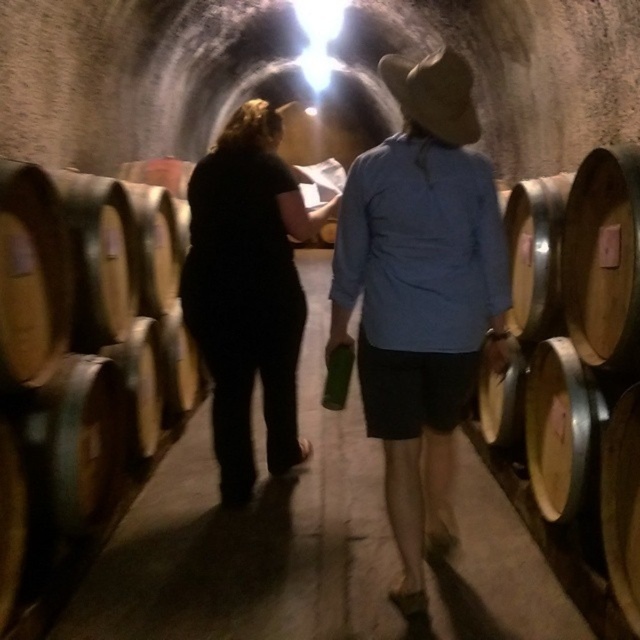
You are a delivery person carrying a box that is 1 meter wide. You need to pass through the tunnel in the wine cellar. Can you fit through the space between the wooden barrel at left and the matte black shirt at center?

The wooden barrel at left is narrower than the matte black shirt at center, so the space between them may vary depending on their positions. However, since the barrel is narrower, there might be enough space for the 1 meter wide box. But without knowing the exact distance between them, it is uncertain. However, the description only states the barrel is narrower, not the distance between them. Therefore, it is impossible to determine if the 1 meter wide box can fit through the space between them based on the

You are a tour guide leading a group through a wine cellar. You notice the wooden barrel at left and the matte black shirt at center. Which object is taller when observed from the entrance?

The matte black shirt at center is taller than the wooden barrel at left.